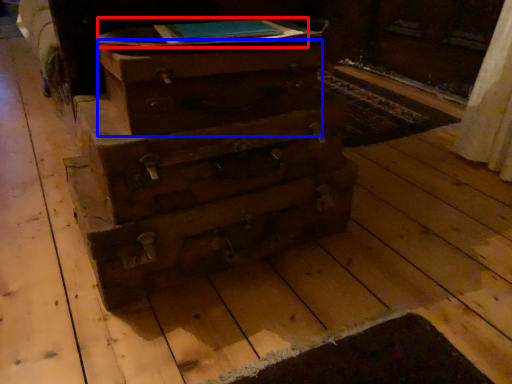
Question: Which point is closer to the camera, book (highlighted by a red box) or drawer (highlighted by a blue box)?

Choices:
 (A) book
 (B) drawer

Answer: (B)